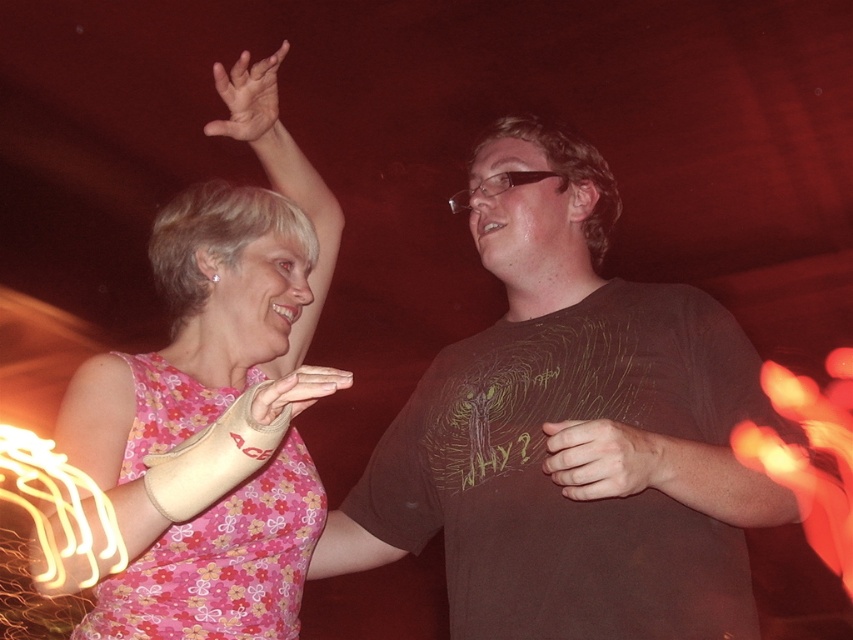
You are at a party and see two objects in the image. One is the smooth skin hand at center and the other is the smooth beige cast at upper center. Which object is located higher up in the image?

The smooth beige cast at upper center is located higher up in the image than the smooth skin hand at center.

You are a photographer at a party and want to capture both the pink floral dress at upper left and the white fabric cast at upper center in a single frame. Given that the camera can only focus on one object at a time, which object should you focus on to ensure the larger one is in sharp detail?

The pink floral dress at upper left is larger in size than the white fabric cast at upper center, so you should focus on the pink floral dress at upper left to ensure it is in sharp detail.